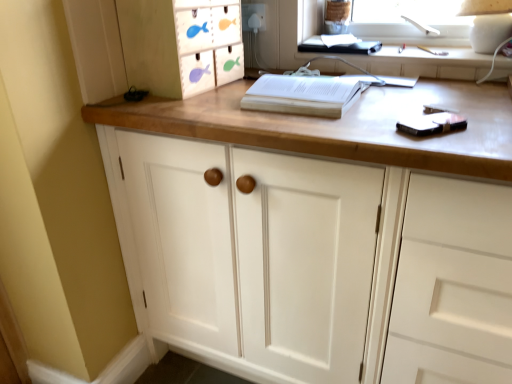
Where is `wooden fish-themed drawer at upper left`? wooden fish-themed drawer at upper left is located at coordinates (181, 44).

What do you see at coordinates (254, 17) in the screenshot? I see `white plastic electric outlet at upper center` at bounding box center [254, 17].

Identify the location of white paper at center. (303, 95).

Is wooden fish-themed drawer at upper left taller or shorter than white plastic electric outlet at upper center?

In the image, wooden fish-themed drawer at upper left appears to be taller than white plastic electric outlet at upper center.

Is wooden fish-themed drawer at upper left not within white plastic electric outlet at upper center?

Yes, wooden fish-themed drawer at upper left is located beyond the bounds of white plastic electric outlet at upper center.

From the image's perspective, is wooden fish-themed drawer at upper left above or below white plastic electric outlet at upper center?

Clearly, from the image's perspective, wooden fish-themed drawer at upper left is below white plastic electric outlet at upper center.

How different are the orientations of wooden fish-themed drawer at upper left and white plastic electric outlet at upper center in degrees?

wooden fish-themed drawer at upper left and white plastic electric outlet at upper center are facing 85.8 degrees away from each other.

From the image's perspective, between white plastic electric outlet at upper center and white wood cabinet at center, which one is located above?

white plastic electric outlet at upper center.

Is white plastic electric outlet at upper center turned away from white wood cabinet at center?

white plastic electric outlet at upper center does not have its back to white wood cabinet at center.

Is white plastic electric outlet at upper center far from white wood cabinet at center?

No, white plastic electric outlet at upper center is not far from white wood cabinet at center.

Is white wood cabinet at center in front of or behind white paper at center in the image?

white wood cabinet at center is in front of white paper at center.

Considering the sizes of white wood cabinet at center and white paper at center in the image, is white wood cabinet at center taller or shorter than white paper at center?

Considering their sizes, white wood cabinet at center has more height than white paper at center.

Which is more to the right, white wood cabinet at center or white paper at center?

From the viewer's perspective, white wood cabinet at center appears more on the right side.

Is white wood cabinet at center next to white paper at center?

white wood cabinet at center and white paper at center are not in contact.

From the image's perspective, is white paper at center on top of white plastic electric outlet at upper center?

No, from the image's perspective, white paper at center is not over white plastic electric outlet at upper center.

Is white paper at center thinner than white plastic electric outlet at upper center?

In fact, white paper at center might be wider than white plastic electric outlet at upper center.

From a real-world perspective, is white paper at center on white plastic electric outlet at upper center?

No, from a real-world perspective, white paper at center is not over white plastic electric outlet at upper center

Looking at this image, would you say white paper at center is to the left or to the right of white plastic electric outlet at upper center in the picture?

Based on their positions, white paper at center is located to the right of white plastic electric outlet at upper center.

Is wooden fish-themed drawer at upper left oriented towards white wood cabinet at center?

No, wooden fish-themed drawer at upper left is not facing towards white wood cabinet at center.

Can you tell me how much wooden fish-themed drawer at upper left and white wood cabinet at center differ in facing direction?

The angle between the facing direction of wooden fish-themed drawer at upper left and the facing direction of white wood cabinet at center is 85.8 degrees.

Who is smaller, wooden fish-themed drawer at upper left or white wood cabinet at center?

wooden fish-themed drawer at upper left is smaller.

Considering the relative sizes of wooden fish-themed drawer at upper left and white wood cabinet at center in the image provided, is wooden fish-themed drawer at upper left wider than white wood cabinet at center?

Incorrect, the width of wooden fish-themed drawer at upper left does not surpass that of white wood cabinet at center.

Is white plastic electric outlet at upper center positioned far away from wooden fish-themed drawer at upper left?

No.

Which is behind, point (256, 5) or point (234, 21)?

The point (256, 5) is more distant.

What's the angular difference between white plastic electric outlet at upper center and wooden fish-themed drawer at upper left's facing directions?

The angular difference between white plastic electric outlet at upper center and wooden fish-themed drawer at upper left is 85.8 degrees.

From the picture: Is white plastic electric outlet at upper center aimed at wooden fish-themed drawer at upper left?

Yes.

Looking at this image, is white paper at center not near wooden fish-themed drawer at upper left?

No.

Which object is further away from the camera taking this photo, white paper at center or wooden fish-themed drawer at upper left?

wooden fish-themed drawer at upper left is behind.

Is point (275, 91) positioned behind point (204, 28)?

That is False.

Locate an element on the screen. This screenshot has height=384, width=512. cabinetry that appears below the white plastic electric outlet at upper center (from a real-world perspective) is located at coordinates (181, 44).

The image size is (512, 384). I want to click on chest of drawers below the white plastic electric outlet at upper center (from the image's perspective), so click(x=319, y=135).

Based on their spatial positions, is white plastic electric outlet at upper center or wooden fish-themed drawer at upper left further from white paper at center?

Among the two, white plastic electric outlet at upper center is located further to white paper at center.

Which object lies further to the anchor point wooden fish-themed drawer at upper left, white wood cabinet at center or white paper at center?

The object further to wooden fish-themed drawer at upper left is white paper at center.

Looking at the image, which one is located further to white paper at center, wooden fish-themed drawer at upper left or white wood cabinet at center?

Among the two, wooden fish-themed drawer at upper left is located further to white paper at center.

Looking at the image, which one is located closer to white wood cabinet at center, wooden fish-themed drawer at upper left or white paper at center?

white paper at center is closer to white wood cabinet at center.

When comparing their distances from wooden fish-themed drawer at upper left, does white plastic electric outlet at upper center or white wood cabinet at center seem closer?

Among the two, white wood cabinet at center is located nearer to wooden fish-themed drawer at upper left.

Which object lies further to the anchor point white plastic electric outlet at upper center, white paper at center or wooden fish-themed drawer at upper left?

The object further to white plastic electric outlet at upper center is white paper at center.

Consider the image. Considering their positions, is white plastic electric outlet at upper center positioned closer to white paper at center than white wood cabinet at center?

Among the two, white wood cabinet at center is located nearer to white paper at center.

Looking at the image, which one is located further to white plastic electric outlet at upper center, white wood cabinet at center or white paper at center?

Based on the image, white wood cabinet at center appears to be further to white plastic electric outlet at upper center.

You are a GUI agent. You are given a task and a screenshot of the screen. Output one action in this format:
    pyautogui.click(x=<x>, y=<y>)
    Task: Click on the cabinetry between white plastic electric outlet at upper center and white wood cabinet at center from top to bottom
    
    Given the screenshot: What is the action you would take?
    pyautogui.click(x=181, y=44)

You are a GUI agent. You are given a task and a screenshot of the screen. Output one action in this format:
    pyautogui.click(x=<x>, y=<y>)
    Task: Click on the paperback book between wooden fish-themed drawer at upper left and white wood cabinet at center from top to bottom
    The width and height of the screenshot is (512, 384).
    Given the screenshot: What is the action you would take?
    pyautogui.click(x=303, y=95)

Identify the location of paperback book positioned between white wood cabinet at center and white plastic electric outlet at upper center from near to far. Image resolution: width=512 pixels, height=384 pixels. (303, 95).

Find the location of `cabinetry positioned between white paper at center and white plastic electric outlet at upper center from near to far`. cabinetry positioned between white paper at center and white plastic electric outlet at upper center from near to far is located at coordinates click(x=181, y=44).